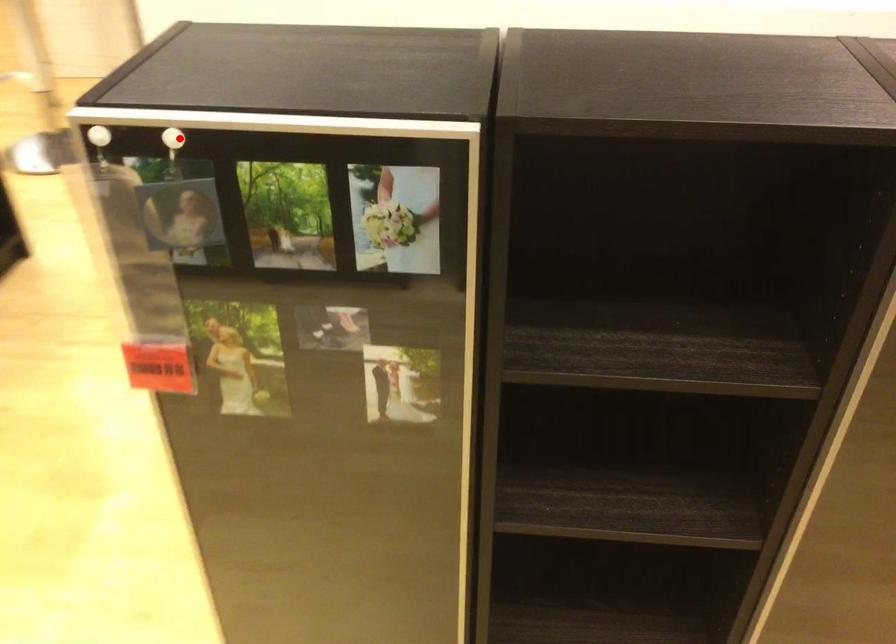
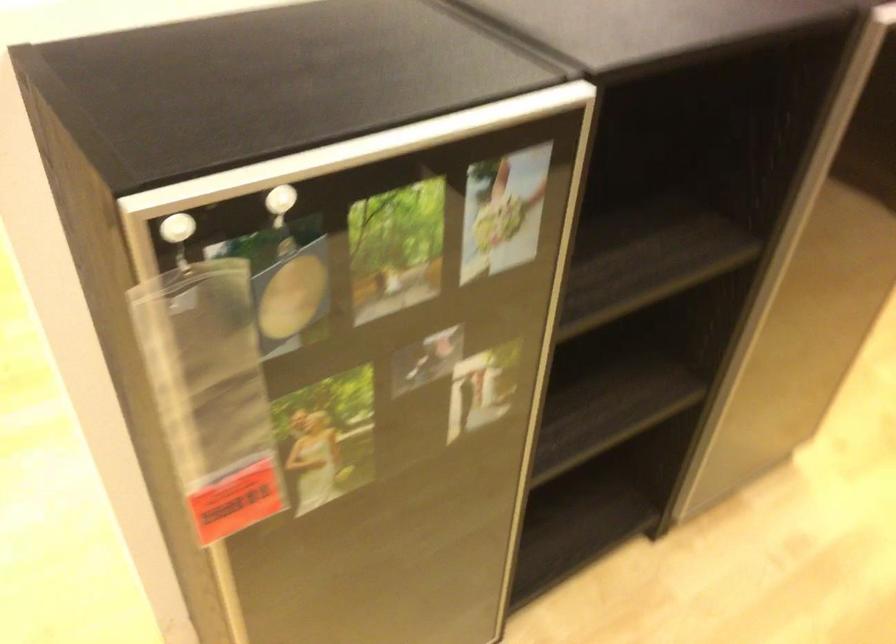
The point at the highlighted location is marked in the first image. Where is the corresponding point in the second image?

(280, 203)